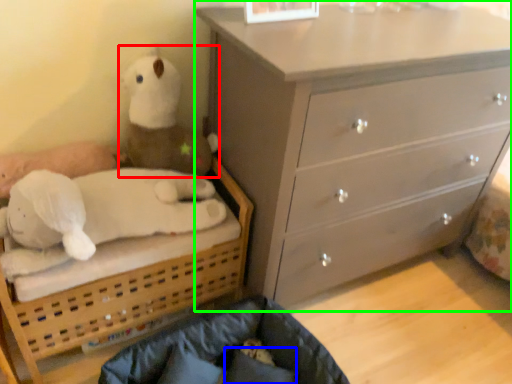
Question: Considering the real-world distances, which object is closest to toy (highlighted by a red box)? pillow (highlighted by a blue box) or chest of drawers (highlighted by a green box).

Choices:
 (A) pillow
 (B) chest of drawers

Answer: (B)